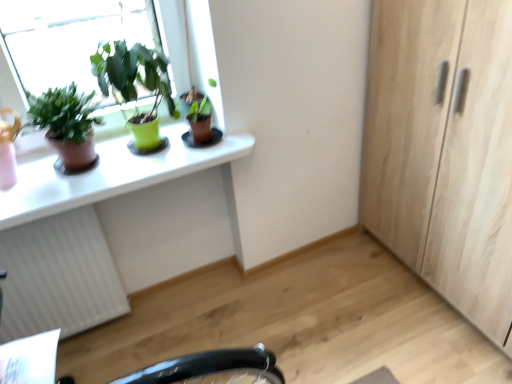
The image size is (512, 384). I want to click on free space in front of green matte pot at upper left, the second houseplant positioned from the right, so click(x=137, y=170).